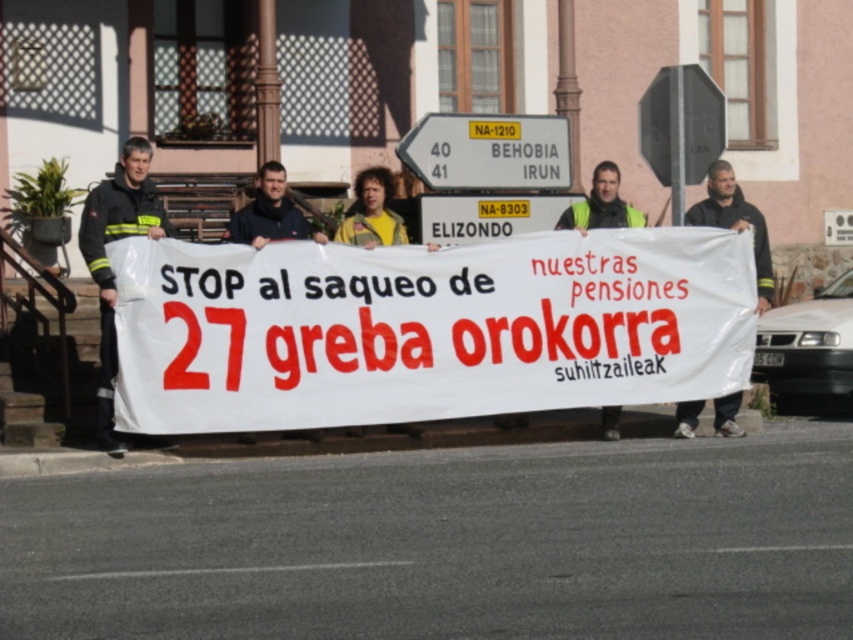
Question: Estimate the real-world distances between objects in this image. Which object is farther from the black octagonal sign at upper center?

Choices:
 (A) yellow plastic sign at center
 (B) white paper banner at center
 (C) yellow fabric shirt at center
 (D) yellow reflective vest at center

Answer: (C)

Question: Which of the following is the farthest from the observer?

Choices:
 (A) black octagonal sign at upper center
 (B) yellow plastic sign at center

Answer: (A)

Question: Is black octagonal sign at upper center wider than yellow reflective vest at center?

Choices:
 (A) yes
 (B) no

Answer: (B)

Question: Can you confirm if black uniform at left is positioned to the right of dark blue sweater at center?

Choices:
 (A) no
 (B) yes

Answer: (A)

Question: Is black octagonal sign at upper center to the right of black fabric at center from the viewer's perspective?

Choices:
 (A) no
 (B) yes

Answer: (A)

Question: Which object is the farthest from the white plastic sign at upper center?

Choices:
 (A) yellow reflective vest at center
 (B) black fabric at center
 (C) dark blue sweater at center
 (D) white paper banner at center

Answer: (C)